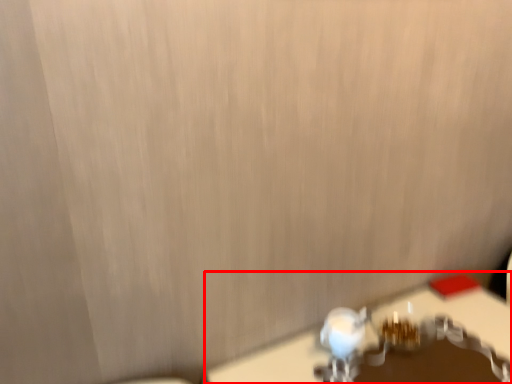
Question: From the image, what is the correct spatial relationship of table (annotated by the red box) in relation to faucet?

Choices:
 (A) left
 (B) right

Answer: (B)